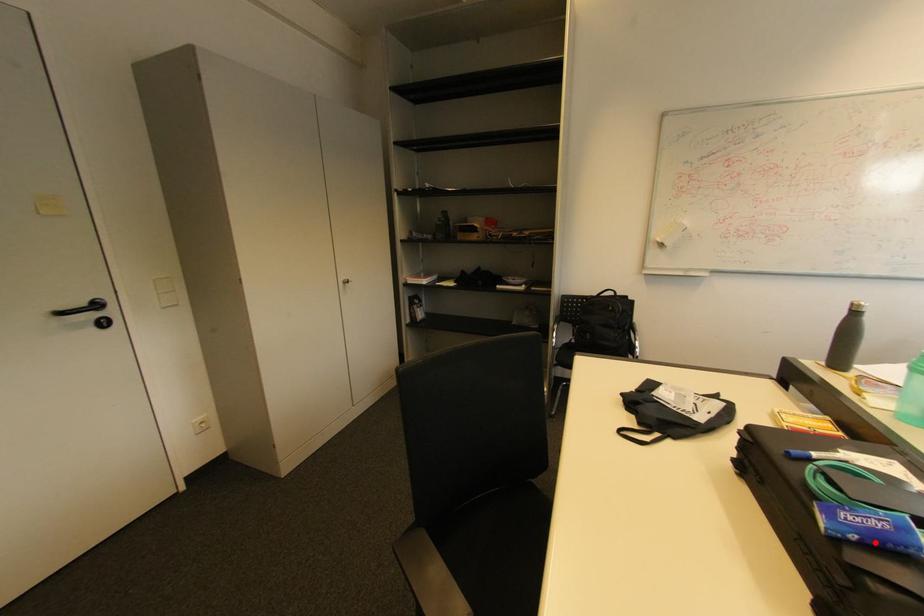
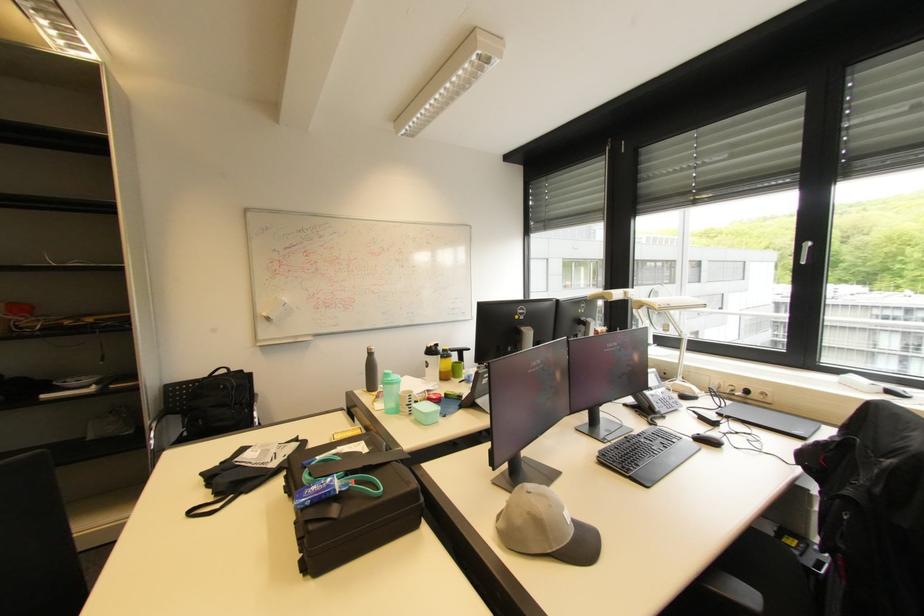
Question: I am providing you with two images of the same scene from different viewpoints. In image1, a red point is highlighted. Considering the same 3D point in image2, which of the following is correct?

Choices:
 (A) It is closer
 (B) It is farther

Answer: (B)